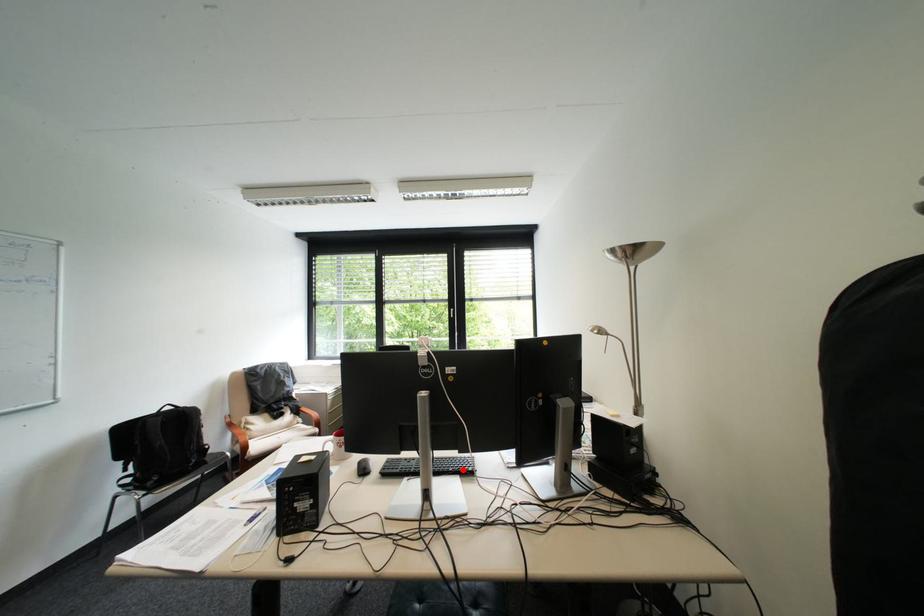
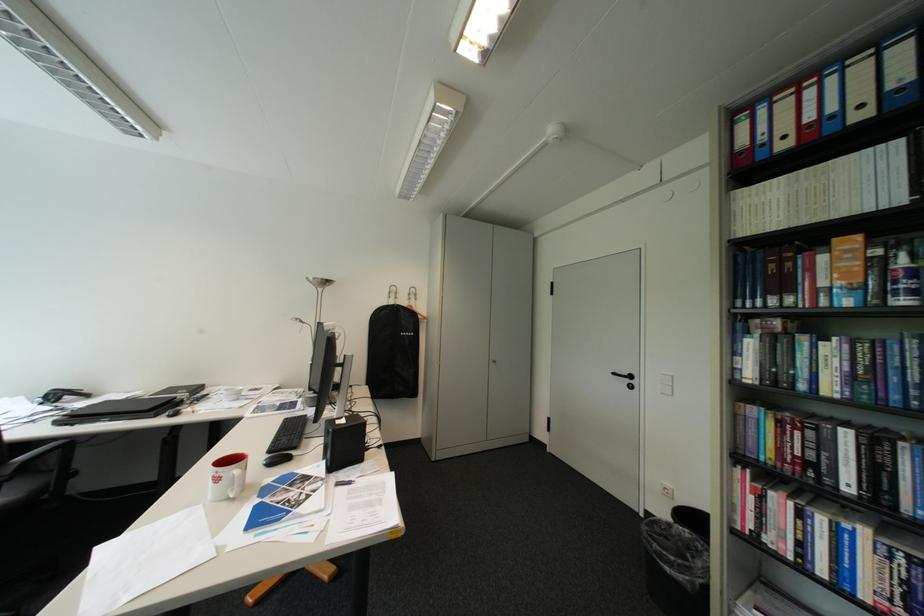
Question: I am providing you with two images of the same scene from different viewpoints. A red point is marked on the first image. Can you still see the location of the red point in image 2?

Choices:
 (A) Yes
 (B) No

Answer: (B)